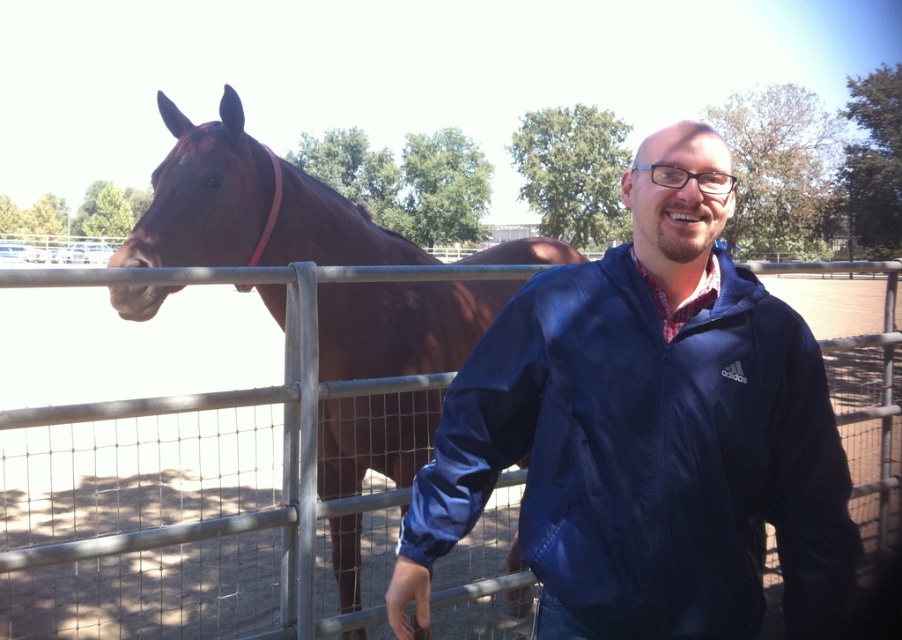
You are taking a photo of the scene and want to focus on both the man and the horse. The man is at point [638,472] and the horse is at point [183,202]. Since you can only focus on one point at a time, which point should you choose to ensure the man is in focus?

You should focus on point [638,472] because it is closer to the camera than point [183,202], ensuring the man is in focus.

You are a photographer standing at the camera position. You want to take a photo of the man and the horse. The focus point of your camera is set to point at the point at (586, 388). Will the man and the horse be in focus?

The point at (586, 388) is 1.51 meters from the camera. Since the man and the horse are both within the same distance range as the focus point, they will likely be in focus.

You are a photographer trying to capture the man in the navy blue windbreaker at right. You need to focus your camera at the point with coordinates (649, 456). Is this point located on the man or the horse?

The point at (649, 456) is on the navy blue windbreaker at right, so it is located on the man.